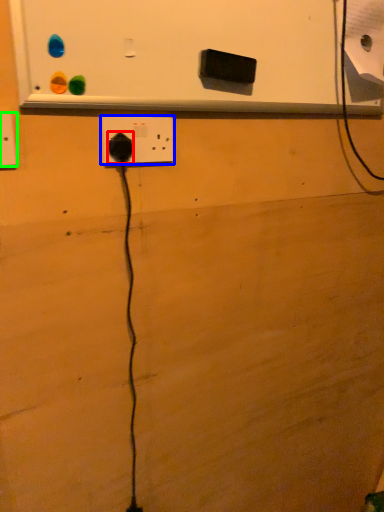
Question: Which is nearer to the power plugs and sockets (highlighted by a red box)? power plugs and sockets (highlighted by a blue box) or power plugs and sockets (highlighted by a green box).

Choices:
 (A) power plugs and sockets
 (B) power plugs and sockets

Answer: (A)